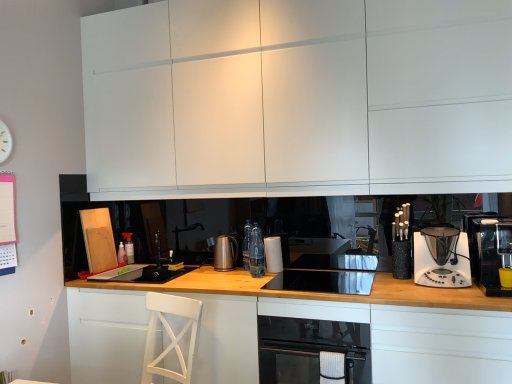
Question: From a real-world perspective, does white matte cabinet at lower left, placed as the 2th cabinetry when sorted from bottom to top, sit lower than white plastic clock at upper left?

Choices:
 (A) no
 (B) yes

Answer: (B)

Question: Can you confirm if white matte cabinet at lower left, which appears as the second cabinetry when viewed from the top, is positioned to the right of white plastic clock at upper left?

Choices:
 (A) yes
 (B) no

Answer: (A)

Question: Considering the relative positions of white matte cabinet at lower left, placed as the 2th cabinetry when sorted from bottom to top, and white plastic clock at upper left in the image provided, is white matte cabinet at lower left, placed as the 2th cabinetry when sorted from bottom to top, to the left of white plastic clock at upper left from the viewer's perspective?

Choices:
 (A) yes
 (B) no

Answer: (B)

Question: From the image's perspective, is white matte cabinet at lower left, which appears as the second cabinetry when viewed from the top, under white plastic clock at upper left?

Choices:
 (A) yes
 (B) no

Answer: (A)

Question: Is white matte cabinet at lower left, placed as the 2th cabinetry when sorted from bottom to top, closer to camera compared to white plastic clock at upper left?

Choices:
 (A) no
 (B) yes

Answer: (B)

Question: From a real-world perspective, relative to white plastic blender at right, acting as the 2th kitchen appliance starting from the right, is white plastic clock at upper left vertically above or below?

Choices:
 (A) above
 (B) below

Answer: (A)

Question: In the image, is white plastic clock at upper left on the left side or the right side of white plastic blender at right, acting as the 2th kitchen appliance starting from the right?

Choices:
 (A) left
 (B) right

Answer: (A)

Question: Considering the positions of white plastic clock at upper left and white plastic blender at right, which is the second kitchen appliance from front to back, in the image, is white plastic clock at upper left taller or shorter than white plastic blender at right, which is the second kitchen appliance from front to back,?

Choices:
 (A) tall
 (B) short

Answer: (B)

Question: Looking at the image, does white plastic clock at upper left seem bigger or smaller compared to white plastic blender at right, which is the second kitchen appliance from front to back?

Choices:
 (A) small
 (B) big

Answer: (A)

Question: From the image's perspective, relative to white matte cabinet at lower left, positioned as the first cabinetry in bottom-to-top order, is black glass oven at lower center above or below?

Choices:
 (A) above
 (B) below

Answer: (A)

Question: From a real-world perspective, is black glass oven at lower center above or below white matte cabinet at lower left, positioned as the first cabinetry in bottom-to-top order?

Choices:
 (A) below
 (B) above

Answer: (B)

Question: Looking at their shapes, would you say black glass oven at lower center is wider or thinner than white matte cabinet at lower left, positioned as the first cabinetry in bottom-to-top order?

Choices:
 (A) wide
 (B) thin

Answer: (B)

Question: Would you say black glass oven at lower center is to the left or to the right of white matte cabinet at lower left, positioned as the first cabinetry in bottom-to-top order, in the picture?

Choices:
 (A) left
 (B) right

Answer: (B)

Question: Choose the correct answer: Is white matte cabinet at upper center, which is the first cabinetry in top-to-bottom order, inside white plastic blender at right, acting as the 2th kitchen appliance starting from the left, or outside it?

Choices:
 (A) inside
 (B) outside

Answer: (B)

Question: From the image's perspective, is white matte cabinet at upper center, which is the first cabinetry in top-to-bottom order, located above or below white plastic blender at right, the 2th kitchen appliance in the back-to-front sequence?

Choices:
 (A) above
 (B) below

Answer: (A)